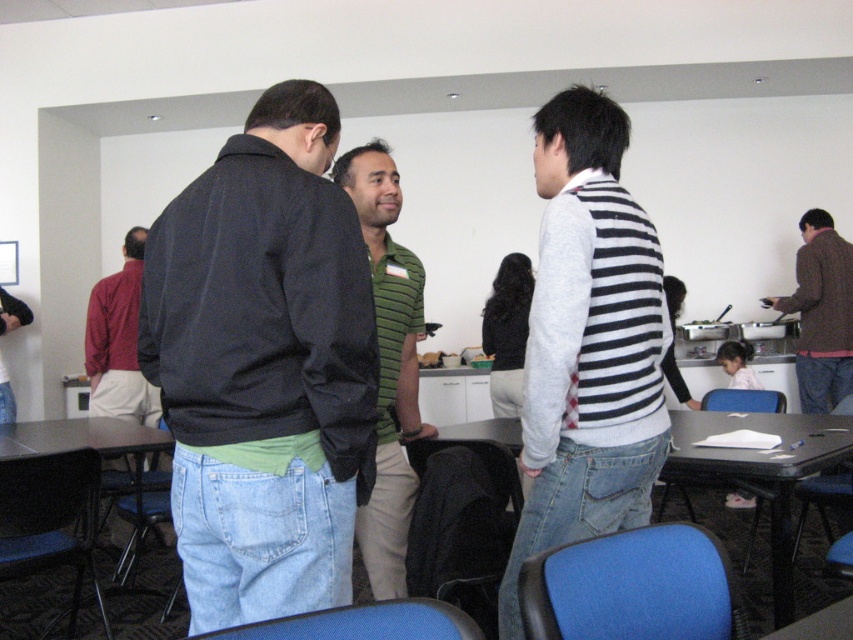
You are standing in the conference room and want to move from point A to point B. Point A is at coordinate point(x=363, y=211) and point B is at coordinate point(x=844, y=416). Which point is closer to you?

Point A at coordinate point(x=363, y=211) is closer to you than point B at coordinate point(x=844, y=416).